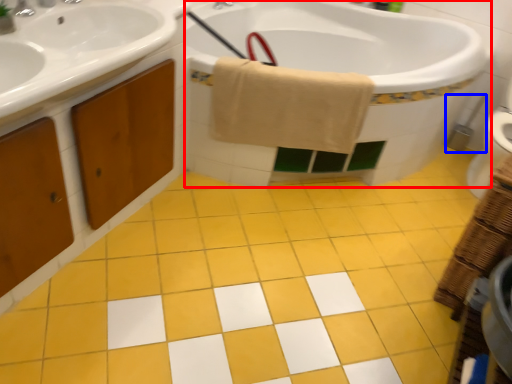
Question: Which of the following is the closest to the observer, bath (highlighted by a red box) or brush (highlighted by a blue box)?

Choices:
 (A) bath
 (B) brush

Answer: (A)